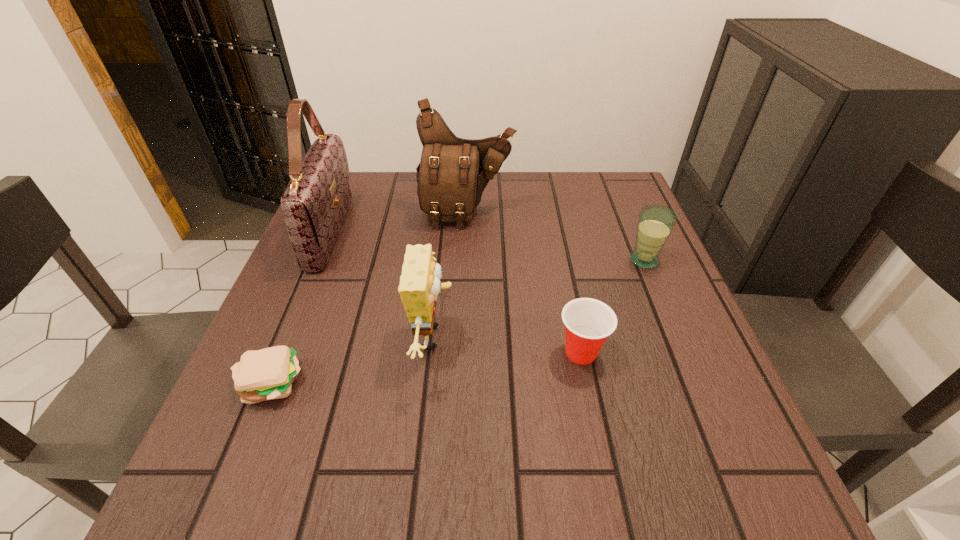
In the image, there is a desktop. Identify the location of vacant space at the far edge. (524, 191).

This screenshot has width=960, height=540. In the image, there is a desktop. Find the location of `blank space at the left edge`. blank space at the left edge is located at coordinates (289, 268).

Find the location of a particular element. Image resolution: width=960 pixels, height=540 pixels. vacant space at the right edge of the desktop is located at coordinates (655, 269).

This screenshot has height=540, width=960. What are the coordinates of `vacant space at the far left corner of the desktop` in the screenshot? It's located at (363, 213).

At what (x,y) coordinates should I click in order to perform the action: click on vacant space at the near left corner. Please return your answer as a coordinate pair (x, y). Looking at the image, I should click on (282, 501).

The height and width of the screenshot is (540, 960). In the image, there is a desktop. What are the coordinates of `free space at the far right corner` in the screenshot? It's located at (615, 177).

Identify the location of vacant space at the near right corner. (678, 512).

Where is `unoccupied position between the third shortest object and the second shortest object`? The image size is (960, 540). unoccupied position between the third shortest object and the second shortest object is located at coordinates (612, 306).

Locate an element on the screen. Image resolution: width=960 pixels, height=540 pixels. empty location between the handbag and the second object from right to left is located at coordinates (456, 292).

Where is `vacant area between the second tallest object and the fourth tallest object`? This screenshot has width=960, height=540. vacant area between the second tallest object and the fourth tallest object is located at coordinates coord(555,237).